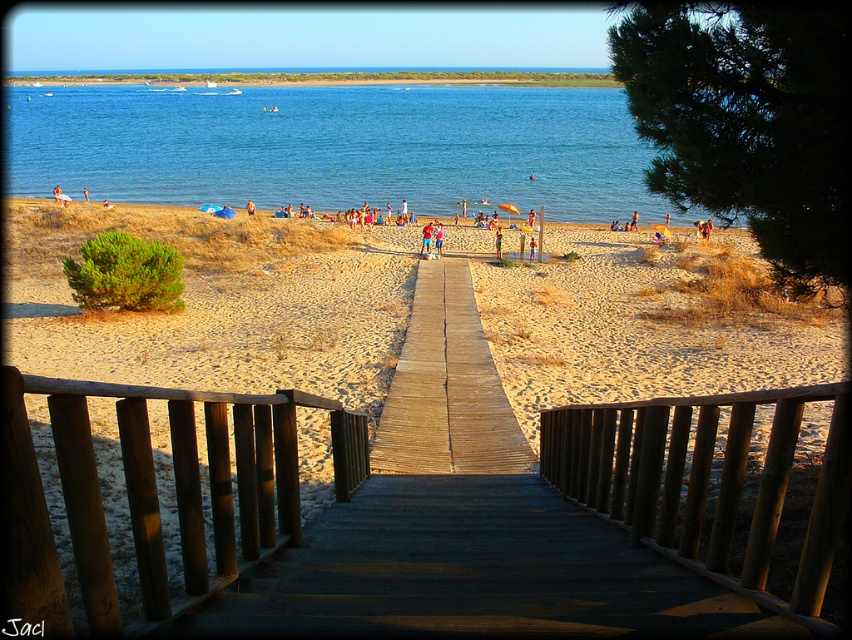
The width and height of the screenshot is (852, 640). Describe the element at coordinates (337, 147) in the screenshot. I see `blue water at center` at that location.

Which is above, blue water at center or brown wooden rail at center?

Positioned higher is blue water at center.

Is point (76, 92) closer to camera compared to point (78, 513)?

No, (76, 92) is further to viewer.

In order to click on blue water at center in this screenshot , I will do `click(337, 147)`.

Is blue water at center closer to camera compared to wooden boardwalk at center?

Yes, it is in front of wooden boardwalk at center.

Is blue water at center to the right of wooden boardwalk at center from the viewer's perspective?

Incorrect, blue water at center is not on the right side of wooden boardwalk at center.

This screenshot has width=852, height=640. What do you see at coordinates (337, 147) in the screenshot?
I see `blue water at center` at bounding box center [337, 147].

Find the location of `blue water at center`. blue water at center is located at coordinates click(337, 147).

Measure the distance between blue water at center and sandy beach at center.

blue water at center and sandy beach at center are 59.39 meters apart from each other.

Is blue water at center positioned behind sandy beach at center?

That is True.

I want to click on blue water at center, so click(x=337, y=147).